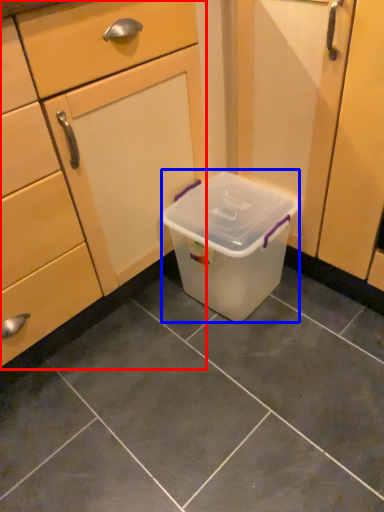
Question: Which object appears closest to the camera in this image, cabinetry (highlighted by a red box) or storage box (highlighted by a blue box)?

Choices:
 (A) cabinetry
 (B) storage box

Answer: (A)